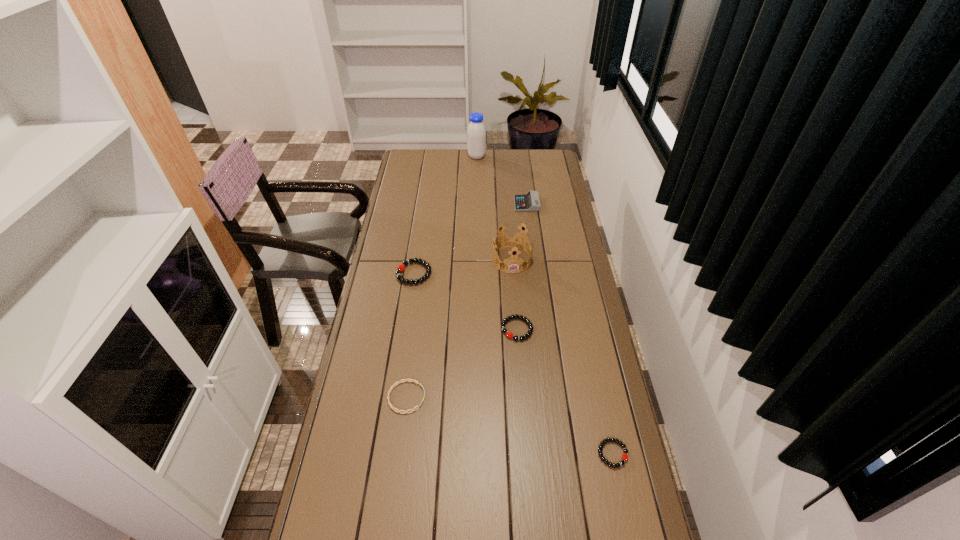
Find the location of a particular element. The width and height of the screenshot is (960, 540). vacant space that satisfies the following two spatial constraints: 1. on the back side of the fourth shortest object; 2. on the right side of the tallest object is located at coordinates (432, 157).

The width and height of the screenshot is (960, 540). In order to click on vacant region that satisfies the following two spatial constraints: 1. on the back side of the farthest black bracelet; 2. on the left side of the sixth nearest object in this screenshot , I will do `click(424, 204)`.

This screenshot has height=540, width=960. Identify the location of free location that satisfies the following two spatial constraints: 1. on the surface of the nearest black bracelet showing star-shaped elements; 2. on the right side of the sixth farthest object. (399, 454).

Find the location of a particular element. The image size is (960, 540). vacant area in the image that satisfies the following two spatial constraints: 1. on the surface of the second nearest bracelet showing star-shaped elements; 2. on the back side of the nearest black bracelet is located at coordinates (399, 454).

Locate an element on the screen. Image resolution: width=960 pixels, height=540 pixels. vacant space that satisfies the following two spatial constraints: 1. on the front side of the tallest object; 2. on the right side of the nearest object is located at coordinates (473, 454).